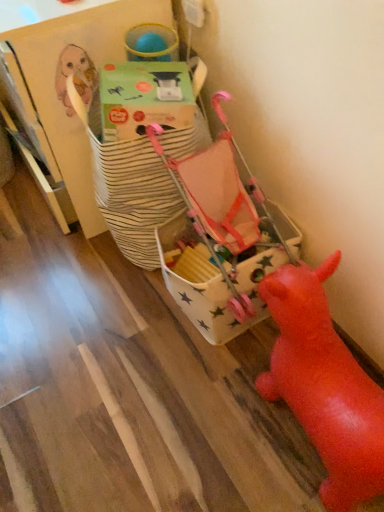
Find the location of a particular element. blank space to the left of rubber red pig at lower right, acting as the second toy starting from the back is located at coordinates (170, 425).